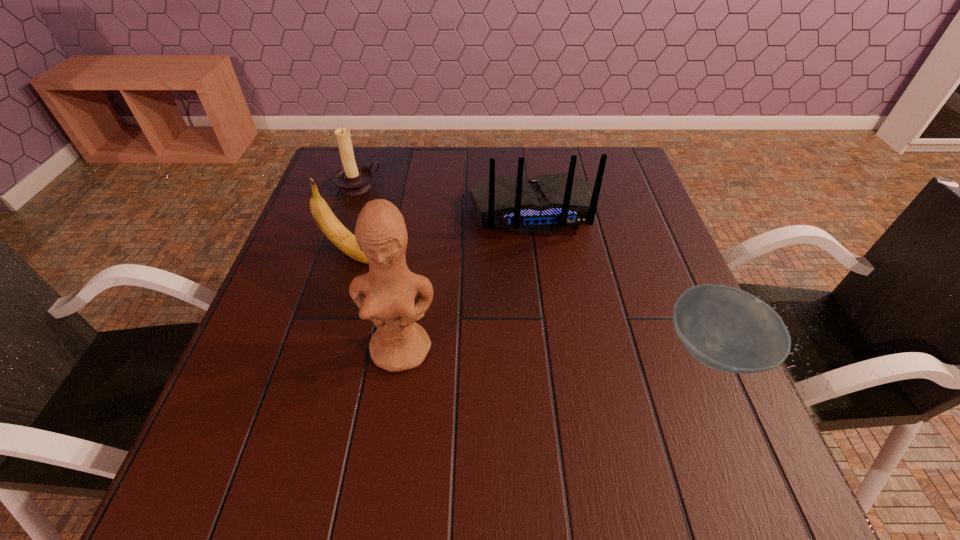
At what (x,y) coordinates should I click in order to perform the action: click on vacant region located 0.150m at the start of the peel on the banana. Please return your answer as a coordinate pair (x, y). Looking at the image, I should click on (427, 292).

I want to click on free location located on the wick of the candle holder, so click(436, 250).

I want to click on vacant space located 0.210m on the wick of the candle holder, so click(414, 232).

You are a GUI agent. You are given a task and a screenshot of the screen. Output one action in this format:
    pyautogui.click(x=<x>, y=<y>)
    Task: Click on the free space located on the wick of the candle holder
    This screenshot has height=540, width=960.
    Given the screenshot: What is the action you would take?
    pyautogui.click(x=409, y=228)

Identify the location of vacant region located 0.130m on the back of the router. [549, 279].

This screenshot has width=960, height=540. I want to click on free space located 0.390m on the back of the router, so click(x=574, y=380).

Find the location of a particular element. The image size is (960, 540). free location located on the back of the router is located at coordinates (554, 299).

Find the location of a particular element. candle holder at the far edge is located at coordinates (352, 179).

Where is `router that is at the far edge`? The image size is (960, 540). router that is at the far edge is located at coordinates (548, 203).

Image resolution: width=960 pixels, height=540 pixels. Find the location of `object located in the near edge section of the desktop`. object located in the near edge section of the desktop is located at coordinates (725, 328).